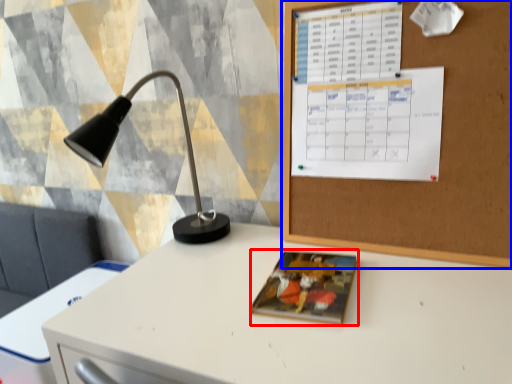
Question: Which point is further to the camera, book cover (highlighted by a red box) or bulletin board (highlighted by a blue box)?

Choices:
 (A) book cover
 (B) bulletin board

Answer: (A)